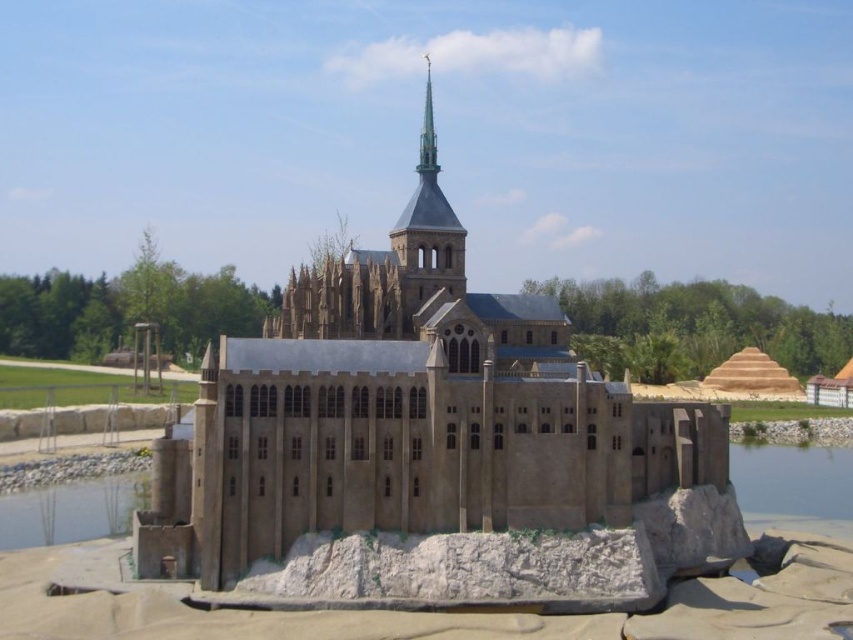
You are a tiny explorer standing at the base of the castle model. You want to travel from the clear water at lower left to the clear water at lower right. Given that your toy boat can only handle distances up to 70 meters, will it be able to make the journey across the body of water?

The distance between the clear water at lower left and clear water at lower right is 68.33 meters, which is within the 70 meters limit of your toy boat. Therefore, the boat can safely make the journey across the body of water.

You are a visitor standing in front of the miniature castle model. You notice the beige stone church at center and the clear water at lower left. Which object is closer to you?

The beige stone church at center is closer to the viewer than the clear water at lower left.

You are a tiny explorer standing at the base of the castle. You want to reach the clear water at lower right. What direction should you move in to get there?

The clear water at lower right is located at point (x=792, y=481), so you should move towards the lower right direction to reach it.